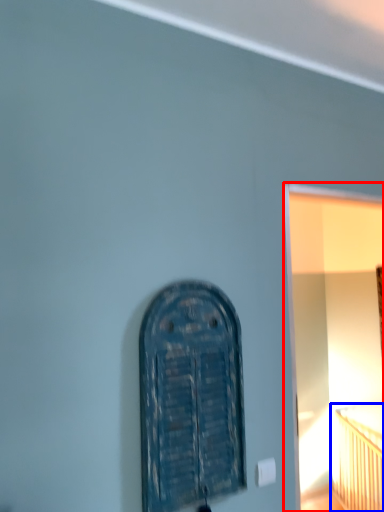
Question: Which object is closer to the camera taking this photo, window frame (highlighted by a red box) or bed (highlighted by a blue box)?

Choices:
 (A) window frame
 (B) bed

Answer: (A)